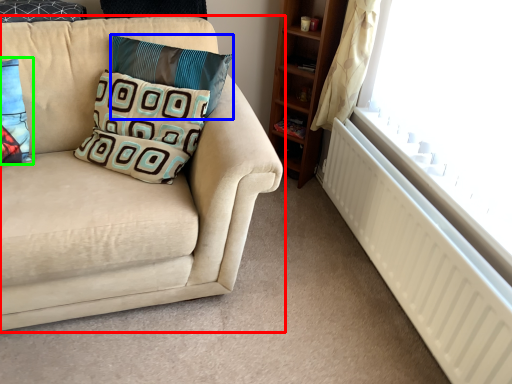
Question: Considering the real-world distances, which object is closest to studio couch (highlighted by a red box)? pillow (highlighted by a blue box) or pillow (highlighted by a green box).

Choices:
 (A) pillow
 (B) pillow

Answer: (A)